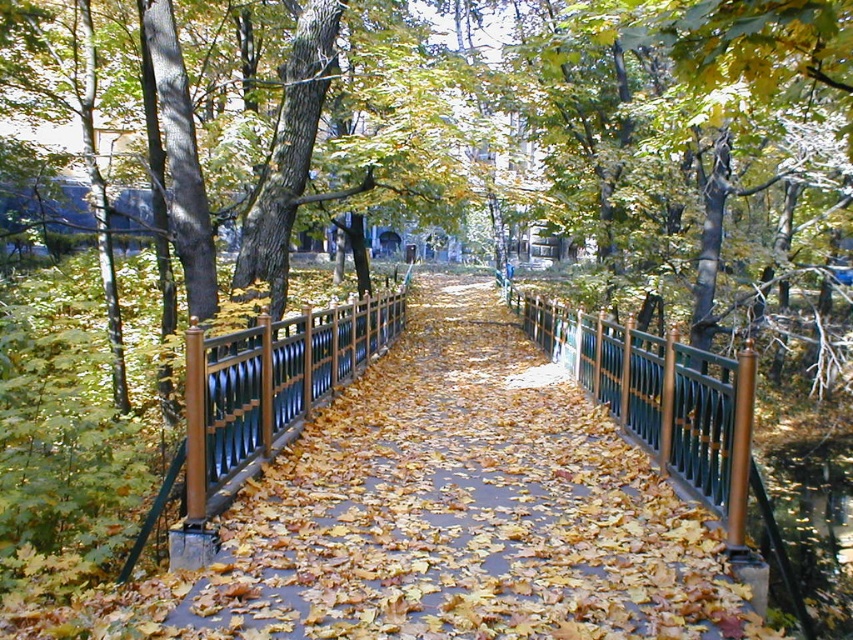
You are a gardener planning to place a new bench along the pathway. You have two options for placement near the metallic green fence at center and the green metal fence at center. Which fence should you choose if you want the bench to be closer to the smaller fence?

The metallic green fence at center is smaller than the green metal fence at center, so you should choose the metallic green fence at center to place the bench closer to the smaller fence.

In the scene shown: You are standing at the entrance of the park and see the metallic green fence at center. If you walk straight ahead, will you encounter the fence before reaching the end of the path?

The metallic green fence at center is located at point coordinates that suggest it is positioned centrally along the path. Since you are starting at the entrance and walking straight, you would reach the fence before the path ends, as it is situated midway.